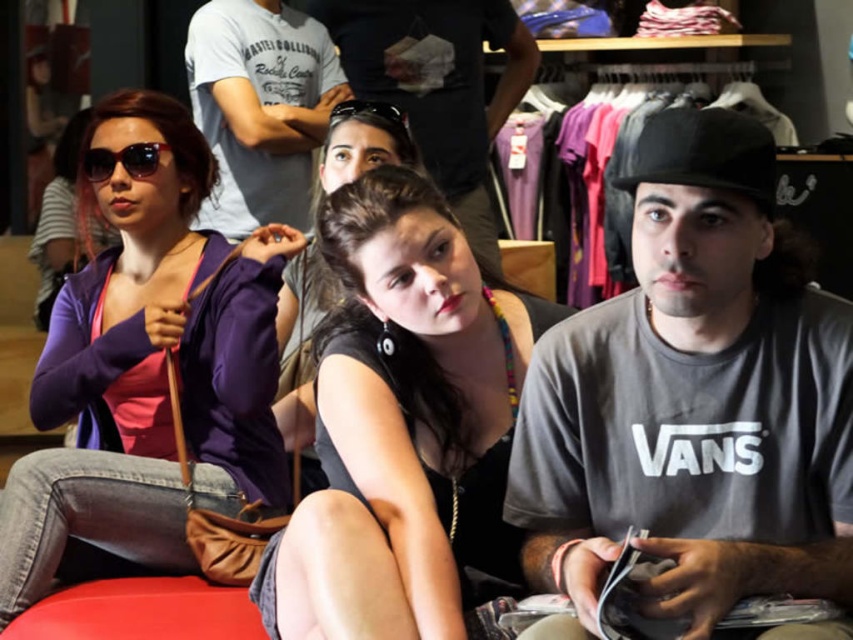
Between gray matte vans t-shirt at center and matte gray t-shirt at center, which one has less height?

With less height is gray matte vans t-shirt at center.

In the scene shown: Is gray matte vans t-shirt at center further to the viewer compared to matte gray t-shirt at center?

No, it is not.

You are a GUI agent. You are given a task and a screenshot of the screen. Output one action in this format:
    pyautogui.click(x=<x>, y=<y>)
    Task: Click on the gray matte vans t-shirt at center
    The width and height of the screenshot is (853, 640).
    Given the screenshot: What is the action you would take?
    pyautogui.click(x=693, y=397)

Does gray matte vans t-shirt at center have a larger size compared to purple soft fabric jacket at left?

No, gray matte vans t-shirt at center is not bigger than purple soft fabric jacket at left.

What do you see at coordinates (693, 397) in the screenshot? I see `gray matte vans t-shirt at center` at bounding box center [693, 397].

You are a GUI agent. You are given a task and a screenshot of the screen. Output one action in this format:
    pyautogui.click(x=<x>, y=<y>)
    Task: Click on the gray matte vans t-shirt at center
    
    Given the screenshot: What is the action you would take?
    pyautogui.click(x=693, y=397)

Who is higher up, white cotton t-shirt at upper center or black matte goggles at center?

white cotton t-shirt at upper center is higher up.

Is white cotton t-shirt at upper center to the right of black matte goggles at center from the viewer's perspective?

In fact, white cotton t-shirt at upper center is to the left of black matte goggles at center.

At what (x,y) coordinates should I click in order to perform the action: click on white cotton t-shirt at upper center. Please return your answer as a coordinate pair (x, y). Looking at the image, I should click on (259, 108).